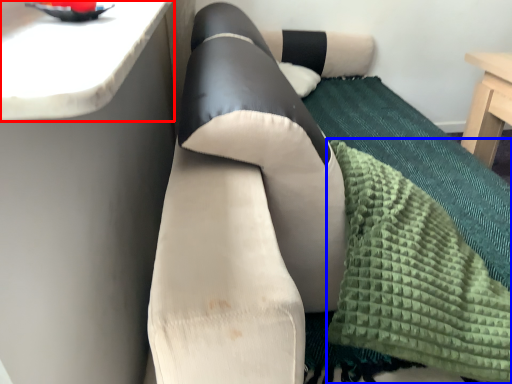
Question: Which of the following is the farthest to the observer, counter top (highlighted by a red box) or blanket (highlighted by a blue box)?

Choices:
 (A) counter top
 (B) blanket

Answer: (B)